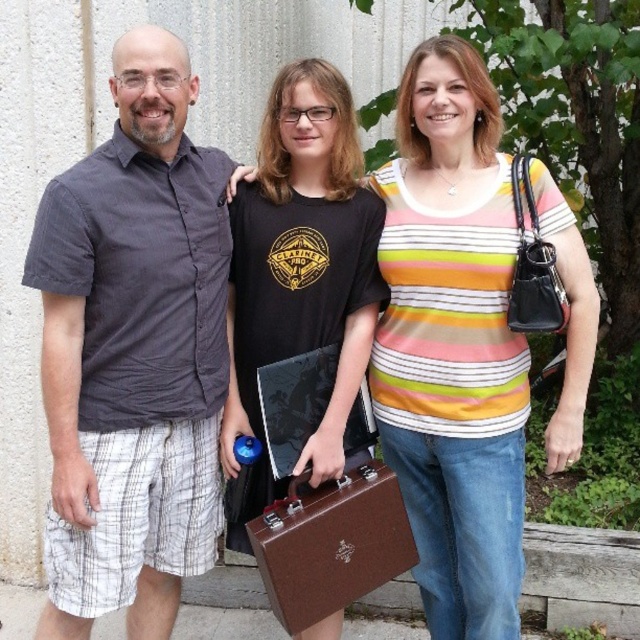
Question: Which of the following is the closest to the observer?

Choices:
 (A) (500, 493)
 (B) (401, 508)
 (C) (192, 372)
 (D) (246, 364)

Answer: (C)

Question: Does striped cotton shirt at center appear over black matte t-shirt at center?

Choices:
 (A) no
 (B) yes

Answer: (A)

Question: Which object appears farthest from the camera in this image?

Choices:
 (A) striped cotton shirt at center
 (B) gray cotton shirt at center
 (C) brown leather briefcase at center
 (D) black matte t-shirt at center

Answer: (D)

Question: Can you confirm if gray cotton shirt at center is positioned to the right of black matte t-shirt at center?

Choices:
 (A) yes
 (B) no

Answer: (B)

Question: Which object is positioned closest to the brown leather briefcase at center?

Choices:
 (A) black matte t-shirt at center
 (B) gray cotton shirt at center

Answer: (A)

Question: Does striped cotton shirt at center appear over black matte t-shirt at center?

Choices:
 (A) no
 (B) yes

Answer: (A)